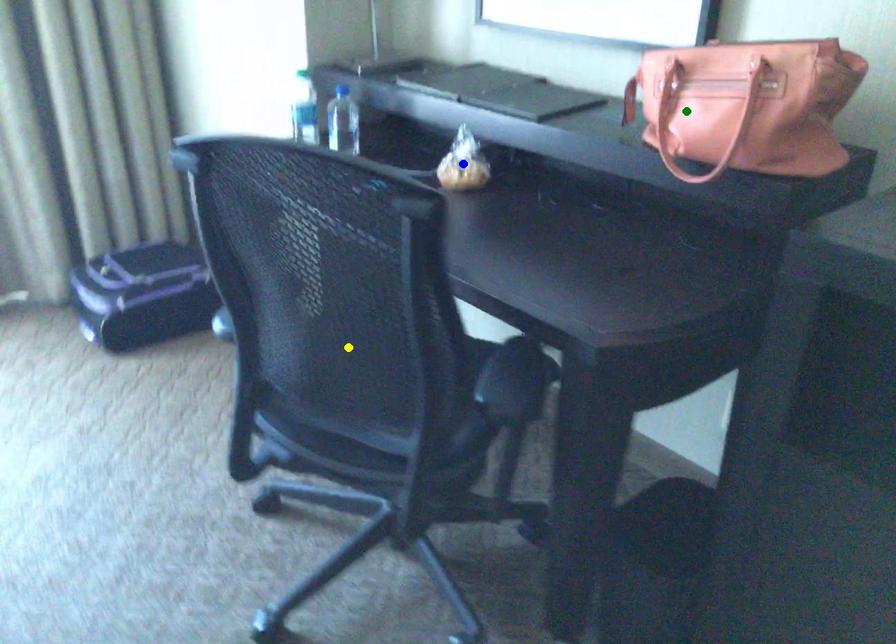
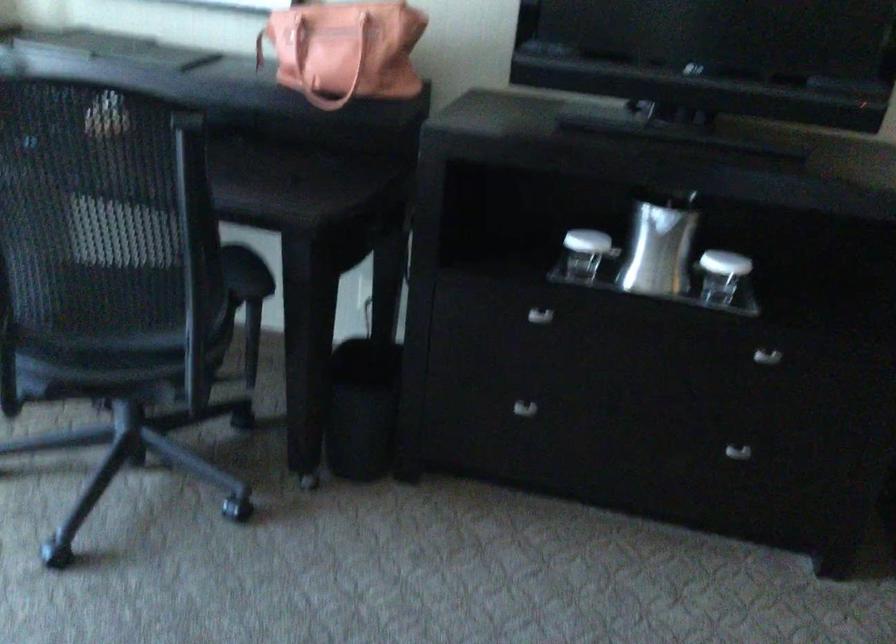
I am providing you with two images of the same scene from different viewpoints. Three points are marked in image1. Which point corresponds to a part or object that is occluded in image2?In image1, three points are marked. Which of them correspond to a part or object that is occluded in image2?Among the three points shown in image1, which one corresponds to a part or object that is no longer visible due to occlusion in image2?

blue point